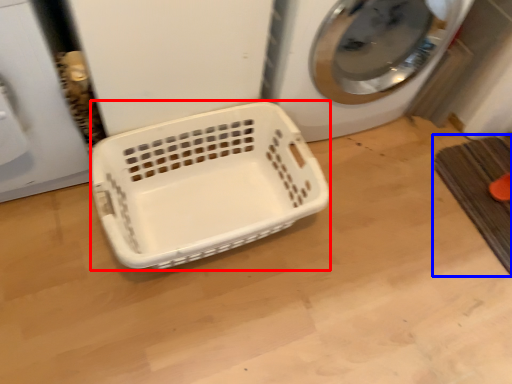
Question: Which object is closer to the camera taking this photo, basket (highlighted by a red box) or bath mat (highlighted by a blue box)?

Choices:
 (A) basket
 (B) bath mat

Answer: (A)